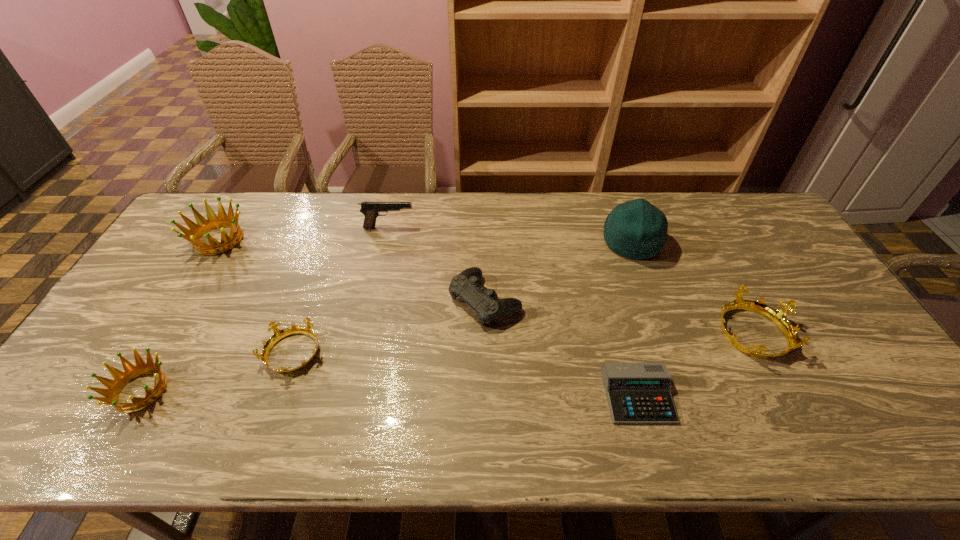
The width and height of the screenshot is (960, 540). I want to click on vacant point located on the right of the gray calculator, so click(x=749, y=396).

Where is `beanie that is at the far edge`? The width and height of the screenshot is (960, 540). beanie that is at the far edge is located at coordinates (636, 229).

What are the coordinates of `pistol located in the far edge section of the desktop` in the screenshot? It's located at (371, 210).

This screenshot has width=960, height=540. I want to click on crown present at the far edge, so pos(203,226).

Identify the location of crown located in the near edge section of the desktop. (114, 387).

Identify the location of calculator situated at the near edge. (638, 393).

This screenshot has width=960, height=540. I want to click on object situated at the far left corner, so click(x=203, y=226).

Where is `object at the near left corner`? This screenshot has width=960, height=540. object at the near left corner is located at coordinates (114, 387).

The image size is (960, 540). In the image, there is a desktop. What are the coordinates of `vacant space at the far edge` in the screenshot? It's located at coord(302,233).

In the image, there is a desktop. Where is `vacant space at the near edge`? The height and width of the screenshot is (540, 960). vacant space at the near edge is located at coordinates (707, 428).